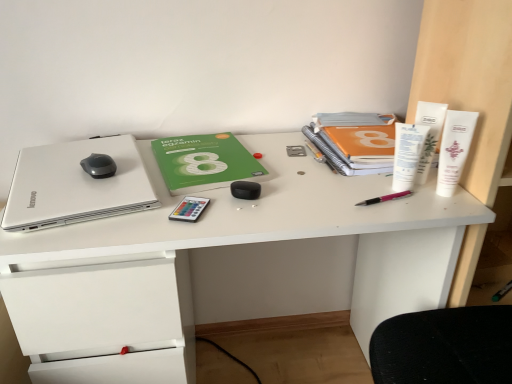
This screenshot has width=512, height=384. I want to click on free space between black plastic remote control at center-left, the 1th stationery in the left-to-right sequence, and white plastic tubes at right, the 3th stationery positioned from the right, so click(x=292, y=201).